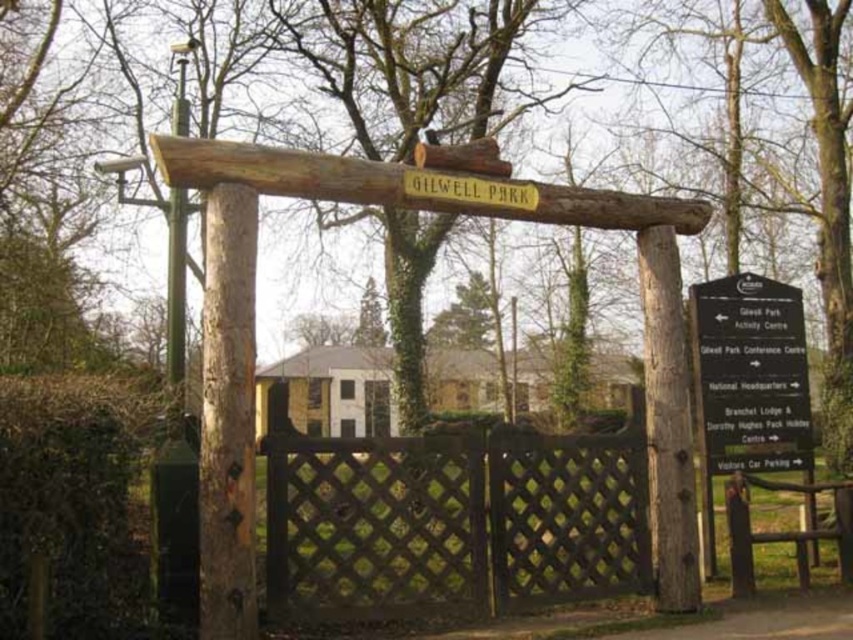
Who is more forward, [419,486] or [693,314]?

Point [419,486] is in front.

Who is more forward, (462,525) or (728,426)?

Positioned in front is point (462,525).

The width and height of the screenshot is (853, 640). I want to click on brown lattice fence at center, so click(451, 518).